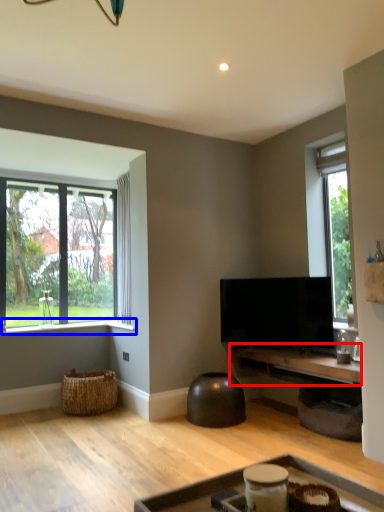
Question: Which of the following is the closest to the observer, table (highlighted by a red box) or window sill (highlighted by a blue box)?

Choices:
 (A) table
 (B) window sill

Answer: (A)